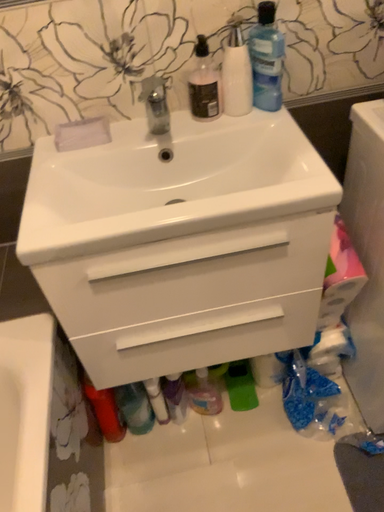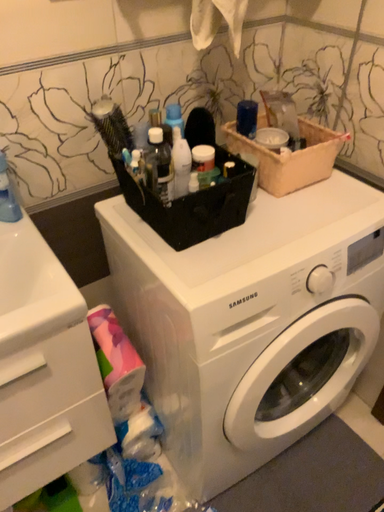
Question: How did the camera likely rotate when shooting the video?

Choices:
 (A) rotated right
 (B) rotated left

Answer: (A)